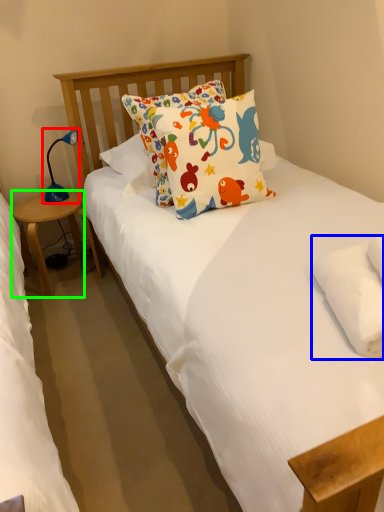
Question: Which is farther away from table lamp (highlighted by a red box)? pillow (highlighted by a blue box) or table (highlighted by a green box)?

Choices:
 (A) pillow
 (B) table

Answer: (A)